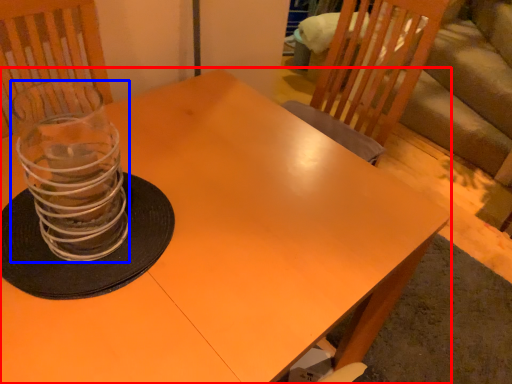
Question: Among these objects, which one is farthest to the camera, table (highlighted by a red box) or candle holder (highlighted by a blue box)?

Choices:
 (A) table
 (B) candle holder

Answer: (B)